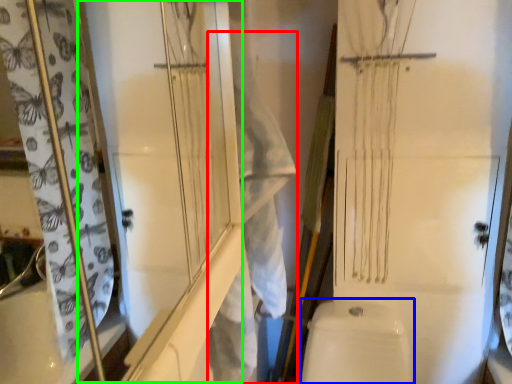
Question: Based on their relative distances, which object is farther from laundry (highlighted by a red box)? Choose from toilet bowl (highlighted by a blue box) and screen door (highlighted by a green box).

Choices:
 (A) toilet bowl
 (B) screen door

Answer: (A)